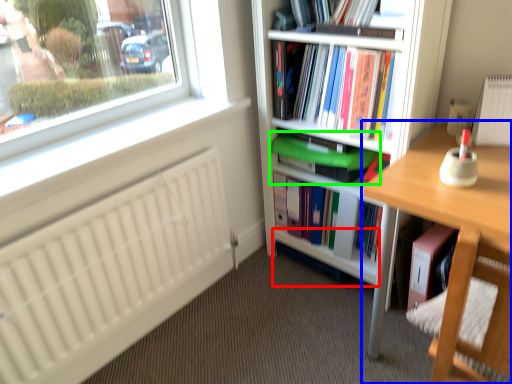
Question: Which object is positioned closest to shelf (highlighted by a red box)? Select from desk (highlighted by a blue box) and book (highlighted by a green box).

Choices:
 (A) desk
 (B) book

Answer: (B)